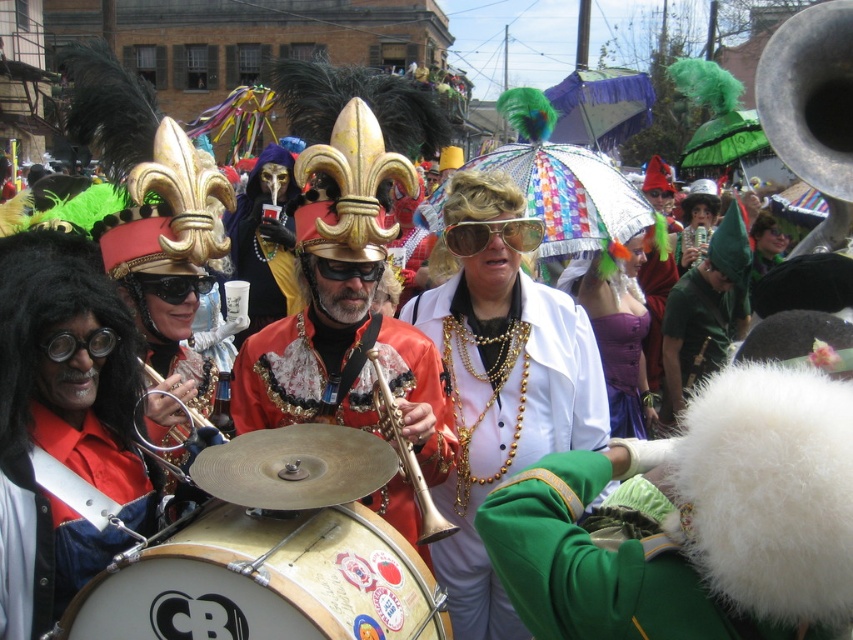
Is gold metallic drum at center to the left of gold reflective sunglasses at center from the viewer's perspective?

Yes, gold metallic drum at center is to the left of gold reflective sunglasses at center.

Does point (154, 628) come behind point (534, 228)?

No, it is not.

Where is `gold metallic drum at center`? gold metallic drum at center is located at coordinates (265, 582).

Which is below, gold metallic drum at center or gold brass trumpet at center?

gold metallic drum at center is below.

Who is more forward, (228, 541) or (381, 428)?

Positioned in front is point (228, 541).

At what (x,y) coordinates should I click in order to perform the action: click on gold metallic drum at center. Please return your answer as a coordinate pair (x, y). This screenshot has width=853, height=640. Looking at the image, I should click on (265, 582).

Describe the element at coordinates (503, 408) in the screenshot. I see `shiny gold sunglasses at center` at that location.

Does shiny gold sunglasses at center lie behind gold brass trumpet at center?

Yes, shiny gold sunglasses at center is further from the viewer.

Between point (485, 173) and point (396, 451), which one is positioned behind?

The point (485, 173) is more distant.

You are a GUI agent. You are given a task and a screenshot of the screen. Output one action in this format:
    pyautogui.click(x=<x>, y=<y>)
    Task: Click on the shiny gold sunglasses at center
    The width and height of the screenshot is (853, 640).
    Given the screenshot: What is the action you would take?
    pyautogui.click(x=503, y=408)